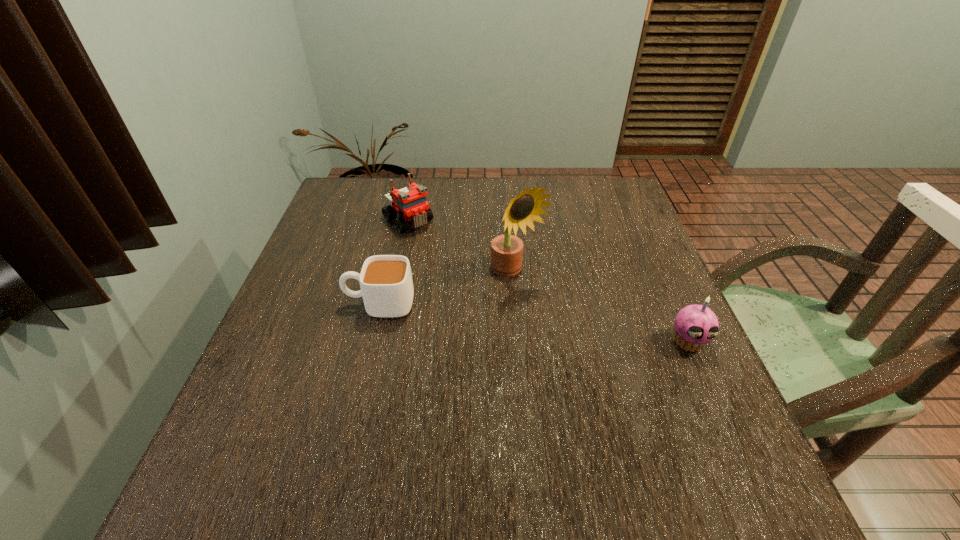
Find the location of a particular element. Image resolution: width=960 pixels, height=540 pixels. vacant space at the near edge is located at coordinates (469, 414).

This screenshot has width=960, height=540. I want to click on vacant area at the left edge of the desktop, so click(x=368, y=231).

What are the coordinates of `free region at the right edge` in the screenshot? It's located at (642, 227).

Where is `free space at the far left corner of the desktop`? The height and width of the screenshot is (540, 960). free space at the far left corner of the desktop is located at coordinates (379, 189).

Where is `free region at the far right corner`? This screenshot has height=540, width=960. free region at the far right corner is located at coordinates (617, 199).

The width and height of the screenshot is (960, 540). Find the location of `vacant space at the near right corner of the desktop`. vacant space at the near right corner of the desktop is located at coordinates (702, 449).

I want to click on empty space that is in between the cupcake and the Lego, so click(548, 281).

At what (x,y) coordinates should I click in order to perform the action: click on vacant space in between the second object from right to left and the shortest object. Please return your answer as a coordinate pair (x, y). The image size is (960, 540). Looking at the image, I should click on (448, 289).

This screenshot has height=540, width=960. Identify the location of vacant area that lies between the cupcake and the farthest object. pos(548,281).

At what (x,y) coordinates should I click in order to perform the action: click on empty space that is in between the tallest object and the cup. Please return your answer as a coordinate pair (x, y). This screenshot has width=960, height=540. Looking at the image, I should click on (448, 289).